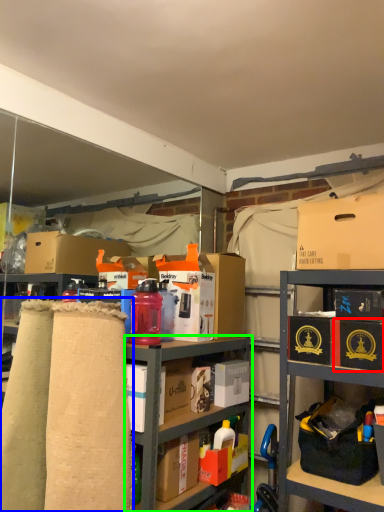
Question: Based on their relative distances, which object is nearer to box (highlighted by a red box)? Choose from fabric (highlighted by a blue box) and cabinetry (highlighted by a green box).

Choices:
 (A) fabric
 (B) cabinetry

Answer: (B)